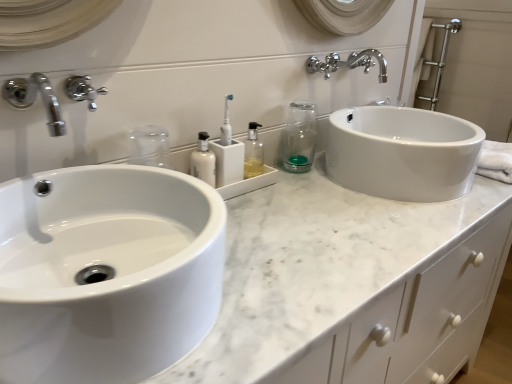
The image size is (512, 384). I want to click on free space in front of white matte bottle at center, which is the 2th mouthwash in back-to-front order, so click(x=247, y=231).